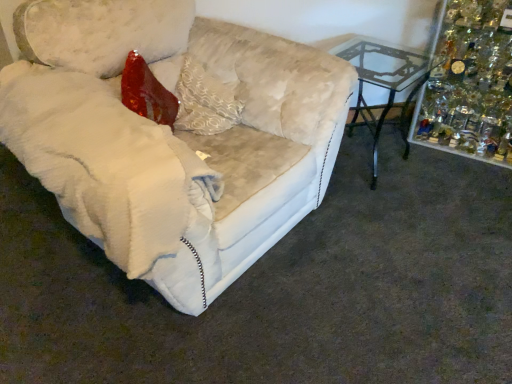
Question: Is white plush couch at left placed right next to white textured pillow at center?

Choices:
 (A) yes
 (B) no

Answer: (B)

Question: Does white plush couch at left have a larger size compared to white textured pillow at center?

Choices:
 (A) no
 (B) yes

Answer: (B)

Question: Is white plush couch at left positioned with its back to white textured pillow at center?

Choices:
 (A) yes
 (B) no

Answer: (A)

Question: Could white textured pillow at center be considered to be inside white plush couch at left?

Choices:
 (A) yes
 (B) no

Answer: (A)

Question: Are white plush couch at left and white textured pillow at center located far from each other?

Choices:
 (A) no
 (B) yes

Answer: (A)

Question: Relative to white textured pillow at center, is shiny glass ornaments at upper right in front or behind?

Choices:
 (A) behind
 (B) front

Answer: (A)

Question: Considering the positions of shiny glass ornaments at upper right and white textured pillow at center in the image, is shiny glass ornaments at upper right taller or shorter than white textured pillow at center?

Choices:
 (A) tall
 (B) short

Answer: (A)

Question: Based on their positions, is shiny glass ornaments at upper right located to the left or right of white textured pillow at center?

Choices:
 (A) right
 (B) left

Answer: (A)

Question: Would you say shiny glass ornaments at upper right is inside or outside white textured pillow at center?

Choices:
 (A) outside
 (B) inside

Answer: (A)

Question: In the image, is white textured pillow at center positioned in front of or behind shiny glass ornaments at upper right?

Choices:
 (A) behind
 (B) front

Answer: (B)

Question: From the image's perspective, is white textured pillow at center above or below shiny glass ornaments at upper right?

Choices:
 (A) above
 (B) below

Answer: (B)

Question: Considering the positions of white textured pillow at center and shiny glass ornaments at upper right in the image, is white textured pillow at center wider or thinner than shiny glass ornaments at upper right?

Choices:
 (A) thin
 (B) wide

Answer: (A)

Question: Based on their sizes in the image, would you say white textured pillow at center is bigger or smaller than shiny glass ornaments at upper right?

Choices:
 (A) big
 (B) small

Answer: (B)

Question: Considering the positions of white plush couch at left and shiny glass ornaments at upper right in the image, is white plush couch at left taller or shorter than shiny glass ornaments at upper right?

Choices:
 (A) short
 (B) tall

Answer: (B)

Question: From the image's perspective, relative to shiny glass ornaments at upper right, is white plush couch at left above or below?

Choices:
 (A) below
 (B) above

Answer: (A)